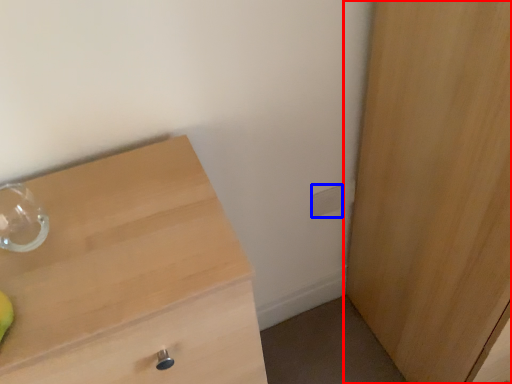
Question: Among these objects, which one is nearest to the camera, cupboard (highlighted by a red box) or electric outlet (highlighted by a blue box)?

Choices:
 (A) cupboard
 (B) electric outlet

Answer: (A)